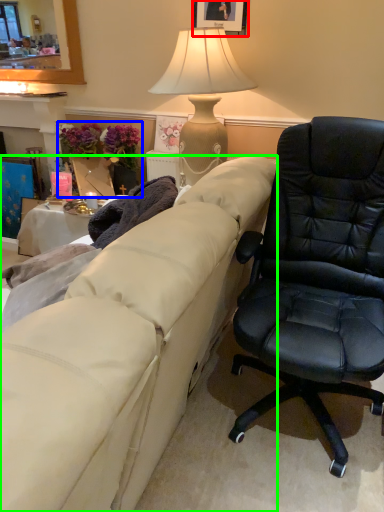
Question: Which object is the closest to the picture frame (highlighted by a red box)? Choose among these: houseplant (highlighted by a blue box) or studio couch (highlighted by a green box).

Choices:
 (A) houseplant
 (B) studio couch

Answer: (A)